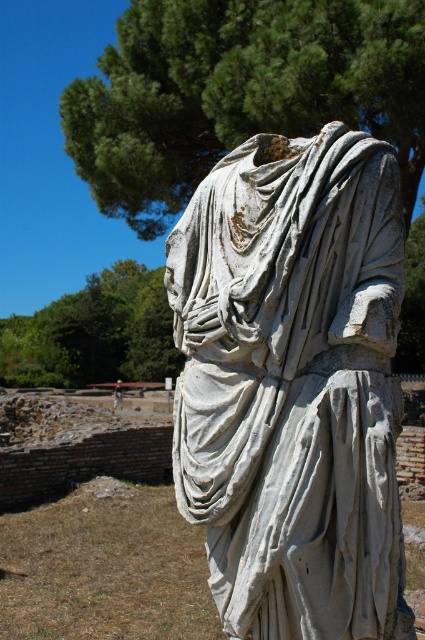
You are an archaeologist examining the ancient site. You notice the green leafy tree at upper center and the blurred fabric statue at center. Which object appears bigger in the image?

The green leafy tree at upper center is larger in size than the blurred fabric statue at center, so the green leafy tree at upper center appears bigger in the image.

Looking at this image, you are an archaeologist standing at the entrance of the archaeological site. You need to locate the white marble statue at center. According to the coordinates provided, where should you look relative to your position?

The white marble statue at center is located at coordinates point (291, 384), which means it is positioned to the right and slightly above your current position as an archaeologist standing at the entrance.